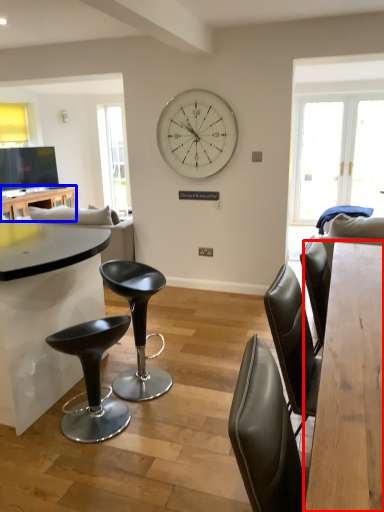
Question: Which object appears closest to the camera in this image, table (highlighted by a red box) or table (highlighted by a blue box)?

Choices:
 (A) table
 (B) table

Answer: (A)